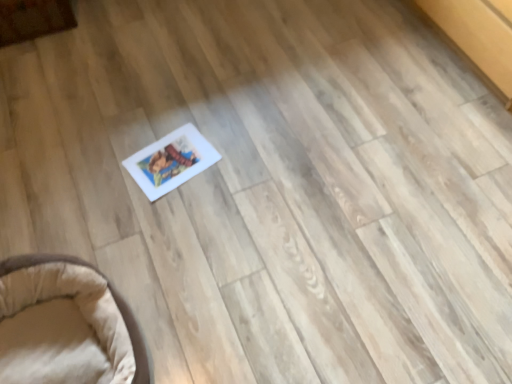
Question: Visually, is beige fabric pet bed at lower left, placed as the 1th furniture when sorted from right to left, positioned to the left or to the right of wooden cabinet at upper left, which ranks as the second furniture in right-to-left order?

Choices:
 (A) right
 (B) left

Answer: (A)

Question: In the image, is beige fabric pet bed at lower left, which appears as the 1th furniture when ordered from the bottom, positioned in front of or behind wooden cabinet at upper left, the 1th furniture from the left?

Choices:
 (A) front
 (B) behind

Answer: (A)

Question: Considering the positions of beige fabric pet bed at lower left, which is the second furniture from back to front, and wooden cabinet at upper left, the second furniture in the front-to-back sequence, in the image, is beige fabric pet bed at lower left, which is the second furniture from back to front, wider or thinner than wooden cabinet at upper left, the second furniture in the front-to-back sequence,?

Choices:
 (A) wide
 (B) thin

Answer: (A)

Question: Would you say wooden cabinet at upper left, which appears as the second furniture when ordered from the bottom, is to the left or to the right of beige fabric pet bed at lower left, which appears as the 1th furniture when ordered from the bottom, in the picture?

Choices:
 (A) right
 (B) left

Answer: (B)

Question: Considering the positions of point (7, 8) and point (42, 258), is point (7, 8) closer or farther from the camera than point (42, 258)?

Choices:
 (A) farther
 (B) closer

Answer: (A)

Question: From a real-world perspective, is wooden cabinet at upper left, the second furniture in the front-to-back sequence, above or below beige fabric pet bed at lower left, which appears as the second furniture when viewed from the left?

Choices:
 (A) above
 (B) below

Answer: (B)

Question: Looking at the image, does wooden cabinet at upper left, which appears as the second furniture when ordered from the bottom, seem bigger or smaller compared to beige fabric pet bed at lower left, which appears as the second furniture when viewed from the left?

Choices:
 (A) big
 (B) small

Answer: (B)